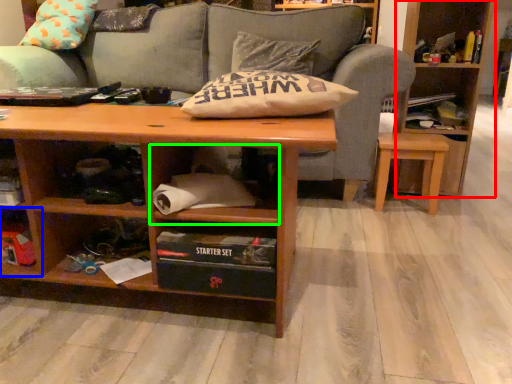
Question: Estimate the real-world distances between objects in this image. Which object is closer to bookcase (highlighted by a red box), shelf (highlighted by a blue box) or cabinet (highlighted by a green box)?

Choices:
 (A) shelf
 (B) cabinet

Answer: (B)